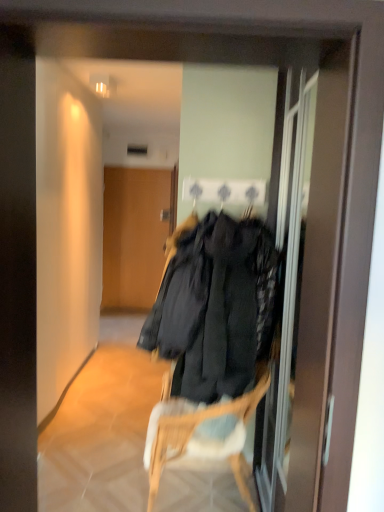
Question: From a real-world perspective, is woven wood chair at center above or below transparent glass screen door at center?

Choices:
 (A) below
 (B) above

Answer: (A)

Question: In terms of size, does woven wood chair at center appear bigger or smaller than transparent glass screen door at center?

Choices:
 (A) big
 (B) small

Answer: (A)

Question: Estimate the real-world distances between objects in this image. Which object is closer to the woven wood chair at center?

Choices:
 (A) transparent glass screen door at center
 (B) wooden door at center

Answer: (A)

Question: Which is nearer to the woven wood chair at center?

Choices:
 (A) wooden door at center
 (B) transparent glass screen door at center

Answer: (B)